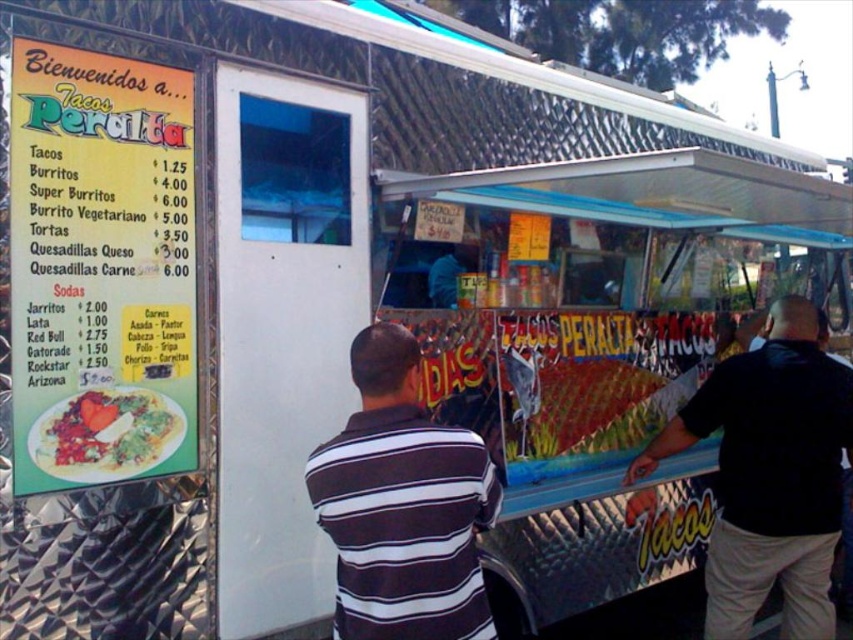
You are a customer at the Tacos Peralta food truck and want to order a Super Burrito. The menu is displayed on the green paper menu at upper left, and there is a vibrant plastic plate at left on the counter. Where should you look to see the price of the Super Burrito?

The green paper menu at upper left lists the prices, so you should look there to see the price of the Super Burrito.

You are a customer waiting in line at the Tacos Peralta food truck. You notice the black matte shirt at right. Where would you look to find the menu prices for the food items?

The menu board on the left side of the truck lists the prices for the food items, so you should look there.

From the picture: You are a customer standing in front of the food truck and want to read the menu. Where is the green paper menu at upper left located?

The green paper menu at upper left is located at point (100,268).